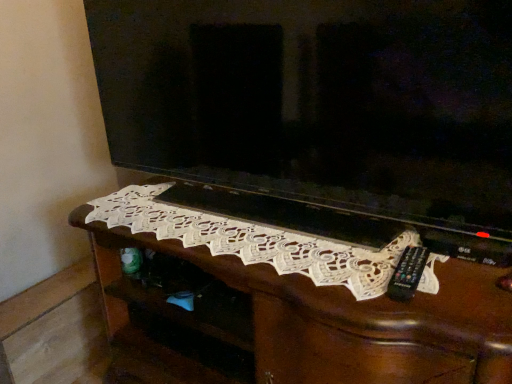
At what (x,y) coordinates should I click in order to perform the action: click on vacant space situated above white lace doily at center (from a real-world perspective). Please return your answer as a coordinate pair (x, y). Looking at the image, I should click on (234, 218).